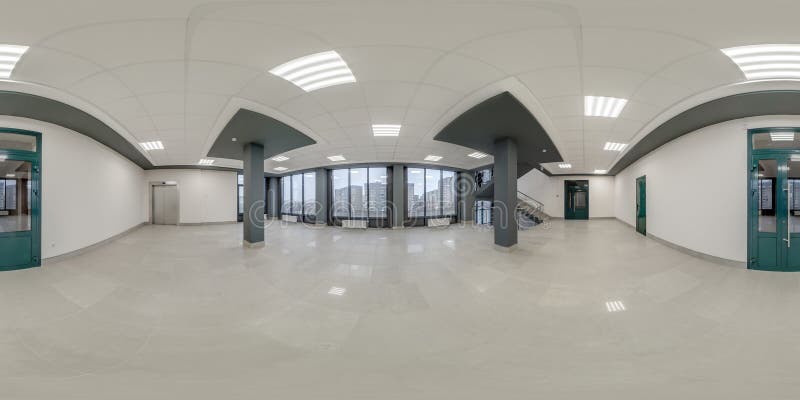
The image size is (800, 400). Find the location of `door handle`. door handle is located at coordinates (786, 222).